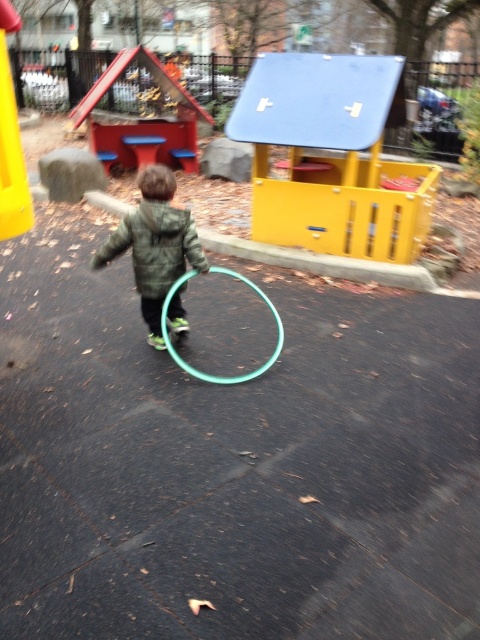
You are a parent trying to locate your child who is wearing a green matte jacket at center. You see the yellow matte playhouse at center in the scene. Based on their positions, can you determine if the playhouse is in front of or behind the child?

The yellow matte playhouse at center is located above the green matte jacket at center, which means it is positioned higher in the image. Since the playhouse is above the child, it is likely positioned behind the child, as objects higher in the image are typically farther away in such scenes.

You are standing at the point with coordinates point (190,365) and want to throw a ball to reach point (157,81). Considering the playground scene described, will the ball pass in front of or behind the child playing with the hula hoop?

The ball thrown from point (190,365) to point (157,81) will pass behind the child playing with the hula hoop because point (157,81) is behind point (190,365).